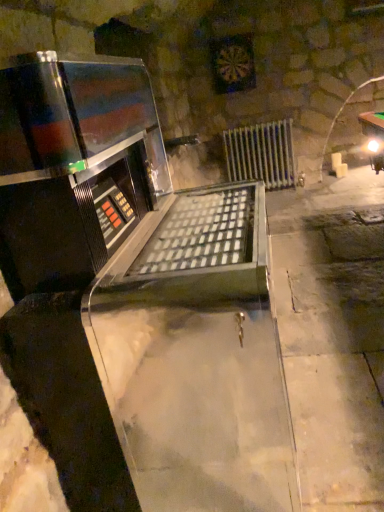
I want to click on shiny metallic wine cellar at center, so click(x=135, y=303).

This screenshot has width=384, height=512. What do you see at coordinates (135, 303) in the screenshot? I see `shiny metallic wine cellar at center` at bounding box center [135, 303].

What is the approximate height of shiny metallic wine cellar at center?

shiny metallic wine cellar at center is 4.50 feet in height.

This screenshot has height=512, width=384. What are the coordinates of `silver metallic radiator at center` in the screenshot? It's located at coord(261,154).

What do you see at coordinates (261, 154) in the screenshot?
I see `silver metallic radiator at center` at bounding box center [261, 154].

Find the location of a particular element. This screenshot has height=512, width=384. shiny metallic wine cellar at center is located at coordinates (135, 303).

Considering the relative positions of shiny metallic wine cellar at center and silver metallic radiator at center in the image provided, is shiny metallic wine cellar at center to the right of silver metallic radiator at center from the viewer's perspective?

No.

Is shiny metallic wine cellar at center in front of or behind silver metallic radiator at center in the image?

Clearly, shiny metallic wine cellar at center is in front of silver metallic radiator at center.

Is point (3, 198) closer or farther from the camera than point (290, 172)?

Clearly, point (3, 198) is closer to the camera than point (290, 172).

From the image's perspective, would you say shiny metallic wine cellar at center is positioned over silver metallic radiator at center?

No, from the image's perspective, shiny metallic wine cellar at center is not above silver metallic radiator at center.

From a real-world perspective, which is physically below, shiny metallic wine cellar at center or silver metallic radiator at center?

silver metallic radiator at center.

Which of these two, shiny metallic wine cellar at center or silver metallic radiator at center, is wider?

With larger width is shiny metallic wine cellar at center.

Between shiny metallic wine cellar at center and silver metallic radiator at center, which one has less height?

Standing shorter between the two is silver metallic radiator at center.

Can you confirm if shiny metallic wine cellar at center is smaller than silver metallic radiator at center?

No, shiny metallic wine cellar at center is not smaller than silver metallic radiator at center.

Is silver metallic radiator at center surrounded by shiny metallic wine cellar at center?

No, shiny metallic wine cellar at center does not contain silver metallic radiator at center.

Is shiny metallic wine cellar at center far away from silver metallic radiator at center?

shiny metallic wine cellar at center is far away from silver metallic radiator at center.

Is shiny metallic wine cellar at center oriented towards silver metallic radiator at center?

No, shiny metallic wine cellar at center does not turn towards silver metallic radiator at center.

How much distance is there between shiny metallic wine cellar at center and silver metallic radiator at center?

shiny metallic wine cellar at center and silver metallic radiator at center are 10.96 feet apart.

This screenshot has width=384, height=512. In order to click on wine cellar below the silver metallic radiator at center (from the image's perspective) in this screenshot , I will do `click(135, 303)`.

Considering the relative positions of silver metallic radiator at center and shiny metallic wine cellar at center in the image provided, is silver metallic radiator at center to the left or to the right of shiny metallic wine cellar at center?

silver metallic radiator at center is to the right of shiny metallic wine cellar at center.

Relative to shiny metallic wine cellar at center, is silver metallic radiator at center in front or behind?

Visually, silver metallic radiator at center is located behind shiny metallic wine cellar at center.

Which is more distant, (242, 146) or (190, 193)?

The point (242, 146) is farther from the camera.

From the image's perspective, is silver metallic radiator at center located above or below shiny metallic wine cellar at center?

From the image's perspective, silver metallic radiator at center appears above shiny metallic wine cellar at center.

From a real-world perspective, which is physically below, silver metallic radiator at center or shiny metallic wine cellar at center?

silver metallic radiator at center.

Can you confirm if silver metallic radiator at center is wider than shiny metallic wine cellar at center?

No, silver metallic radiator at center is not wider than shiny metallic wine cellar at center.

Between silver metallic radiator at center and shiny metallic wine cellar at center, which one has less height?

With less height is silver metallic radiator at center.

Based on the photo, is silver metallic radiator at center smaller than shiny metallic wine cellar at center?

Yes, silver metallic radiator at center is smaller than shiny metallic wine cellar at center.

Is shiny metallic wine cellar at center inside silver metallic radiator at center?

Definitely not — shiny metallic wine cellar at center is not inside silver metallic radiator at center.

Is silver metallic radiator at center not near shiny metallic wine cellar at center?

Yes, silver metallic radiator at center is far from shiny metallic wine cellar at center.

Does silver metallic radiator at center turn towards shiny metallic wine cellar at center?

Yes, silver metallic radiator at center is oriented towards shiny metallic wine cellar at center.

Can you tell me how much silver metallic radiator at center and shiny metallic wine cellar at center differ in facing direction?

86.5 degrees separate the facing orientations of silver metallic radiator at center and shiny metallic wine cellar at center.

Measure the distance from silver metallic radiator at center to shiny metallic wine cellar at center.

The distance of silver metallic radiator at center from shiny metallic wine cellar at center is 3.34 meters.

This screenshot has height=512, width=384. I want to click on radiator directly beneath the shiny metallic wine cellar at center (from a real-world perspective), so click(x=261, y=154).

Where is `wine cellar on the left of silver metallic radiator at center`? This screenshot has height=512, width=384. wine cellar on the left of silver metallic radiator at center is located at coordinates [x=135, y=303].

The height and width of the screenshot is (512, 384). In order to click on radiator to the right of shiny metallic wine cellar at center in this screenshot , I will do `click(261, 154)`.